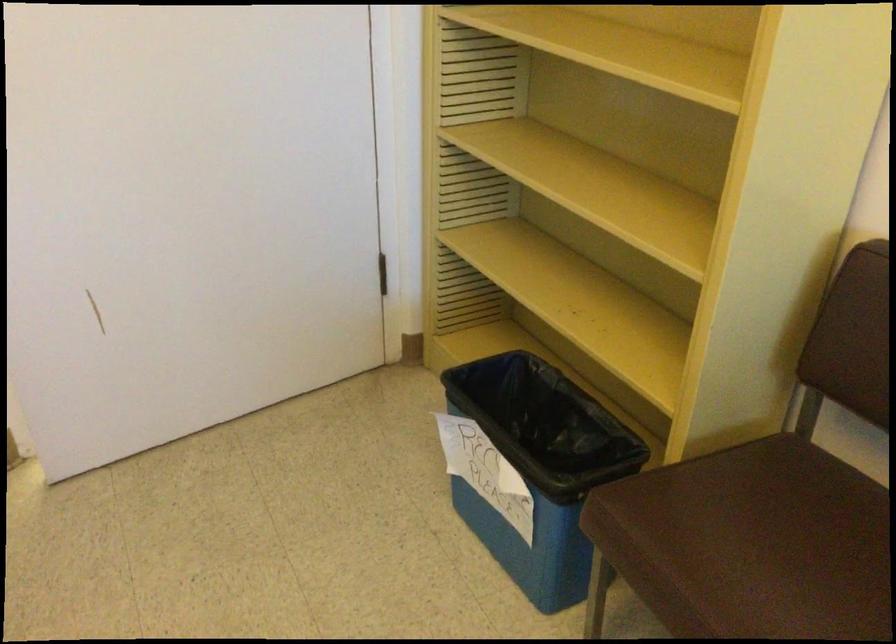
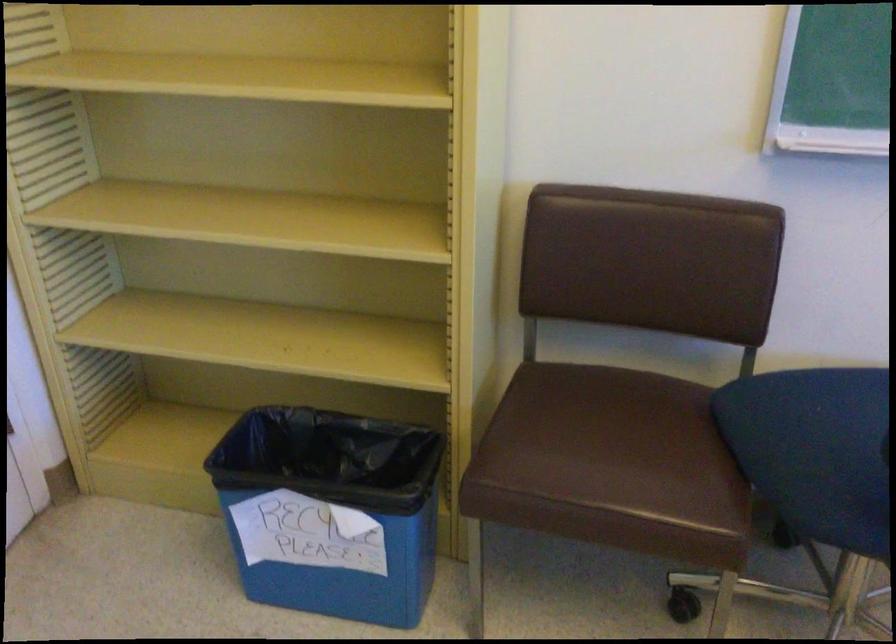
Find the pixel in the second image that matches the point at 734,570 in the first image.

(610, 464)